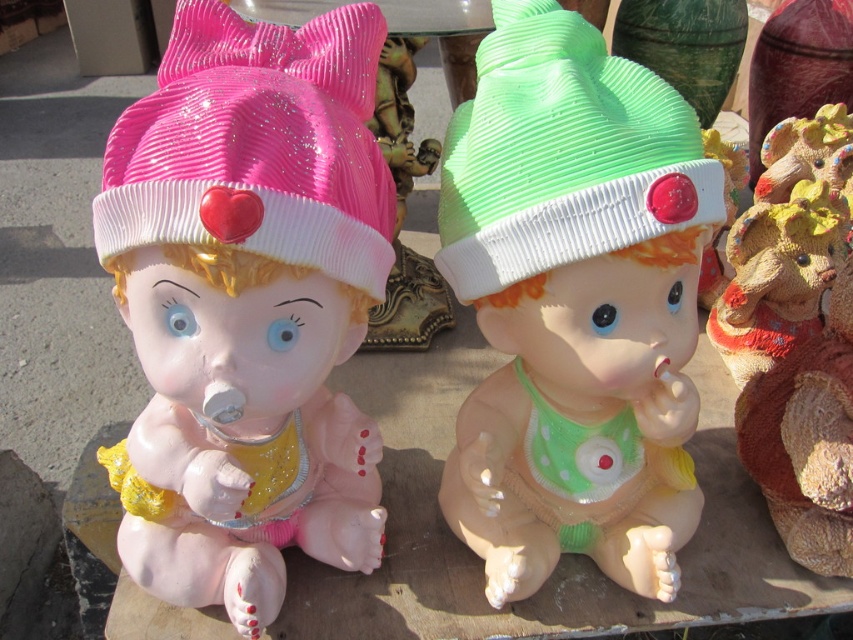
You are arranging a shelf and want to place the matte plastic doll at center and the textured brown bear at right so that the bear is above the doll. Is this arrangement possible based on their current positions?

The matte plastic doll at center is located below the textured brown bear at right, so arranging them with the bear above the doll would require moving the doll downward or the bear upward, which is possible as long as there is enough vertical space on the shelf.

You are looking at a collection of vintage baby figurines. You notice a point marked at coordinates (248, 301). Which object does this point correspond to?

The point at coordinates (248, 301) corresponds to the matte plastic doll at center.

You are looking at the image of two baby figurines. Based on the coordinates provided, which object is located at point (x=248, y=301)?

The point (x=248, y=301) corresponds to the matte plastic doll at center.